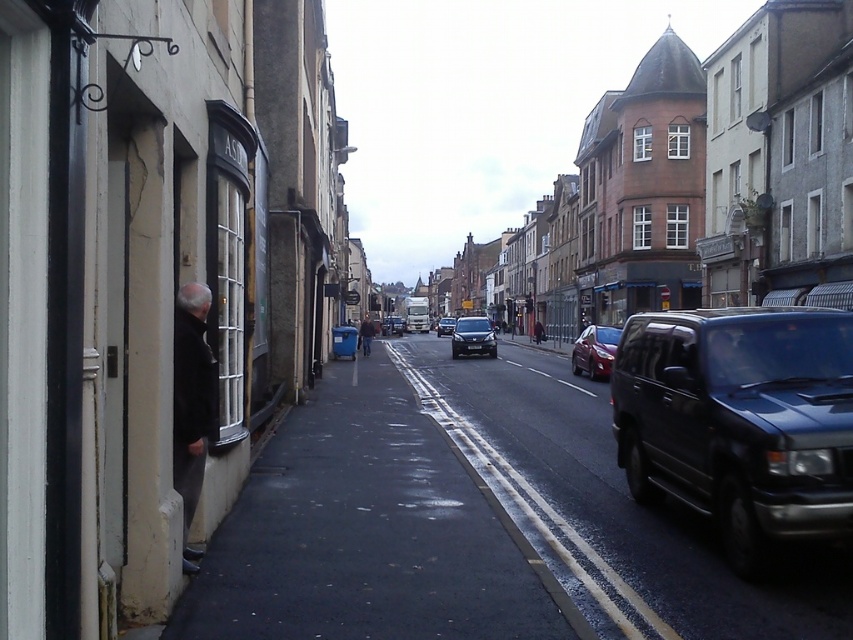
You are standing on the sidewalk looking down the street. There is a shiny red car at center. Where is the point located at coordinates (595, 349)?

The point at coordinates (595, 349) is on the shiny red car at center.